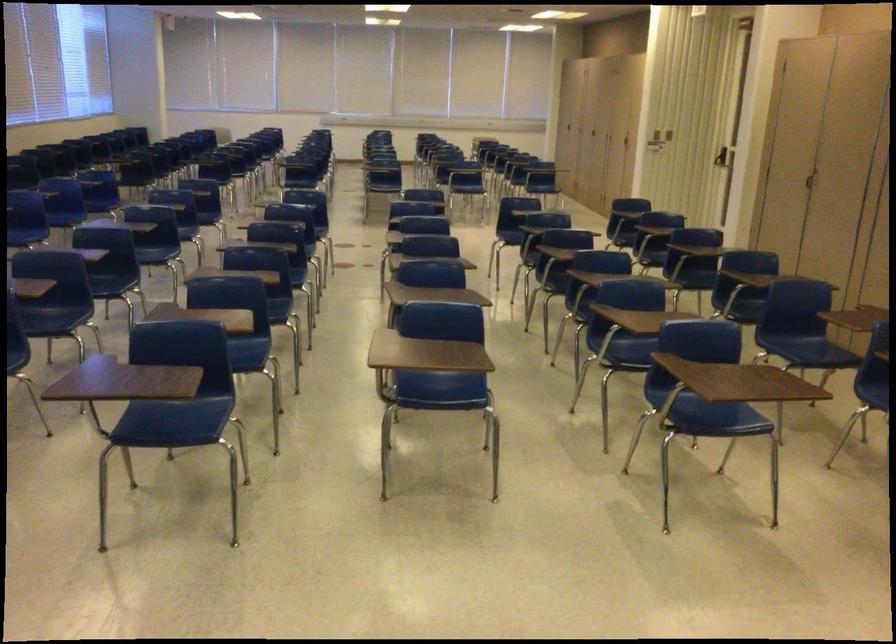
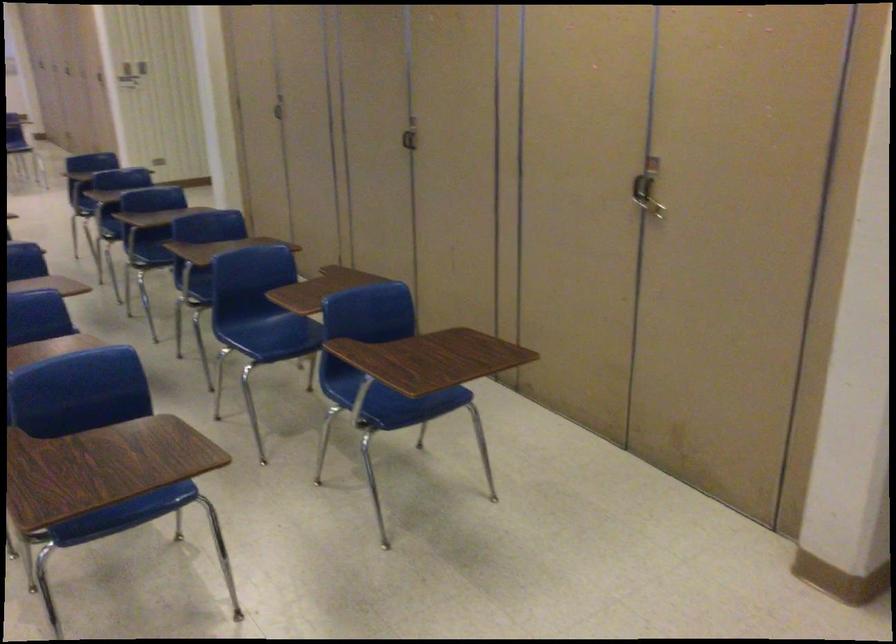
Where in the second image is the point corresponding to pixel 721 426 from the first image?

(126, 516)